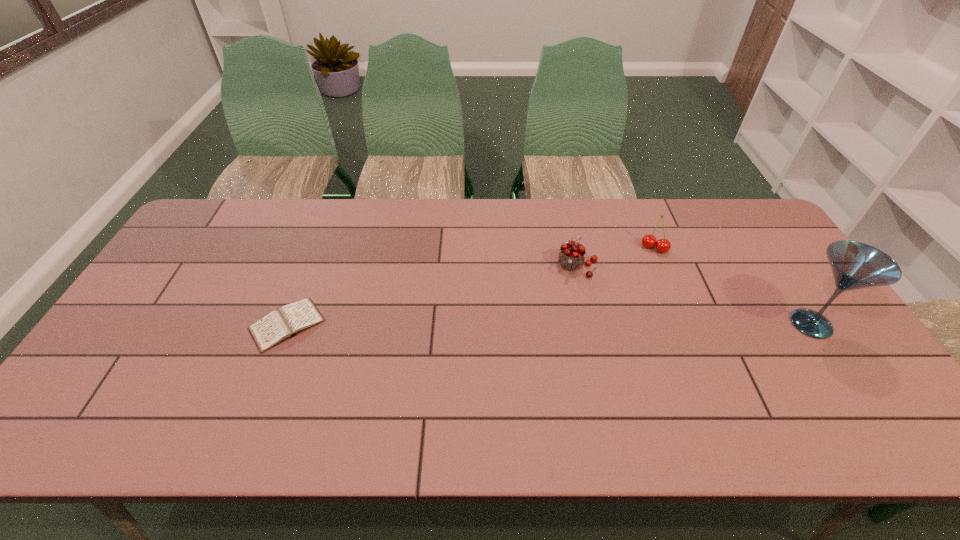
Where is `the leftmost object`? The height and width of the screenshot is (540, 960). the leftmost object is located at coordinates (279, 325).

Locate an element on the screen. diary is located at coordinates (279, 325).

The image size is (960, 540). I want to click on the rightmost object, so click(855, 265).

Identify the location of martini. The height and width of the screenshot is (540, 960). (855, 265).

The width and height of the screenshot is (960, 540). What are the coordinates of `the right pot filled with cherries` in the screenshot? It's located at (662, 245).

At what (x,y) coordinates should I click in order to perform the action: click on the third object from right to left. Please return your answer as a coordinate pair (x, y). The image size is (960, 540). Looking at the image, I should click on (571, 256).

You are a GUI agent. You are given a task and a screenshot of the screen. Output one action in this format:
    pyautogui.click(x=<x>, y=<y>)
    Task: Click on the vacant space located 0.130m on the front of the diary
    
    Given the screenshot: What is the action you would take?
    click(x=258, y=401)

I want to click on vacant point located 0.100m on the front of the tallest object, so click(849, 381).

Where is `free region located with the stems of the third object from left to right pointing upwards`? free region located with the stems of the third object from left to right pointing upwards is located at coordinates (645, 266).

In order to click on vacant region located 0.220m with the stems of the third object from left to right pointing upwards in this screenshot , I will do `click(631, 301)`.